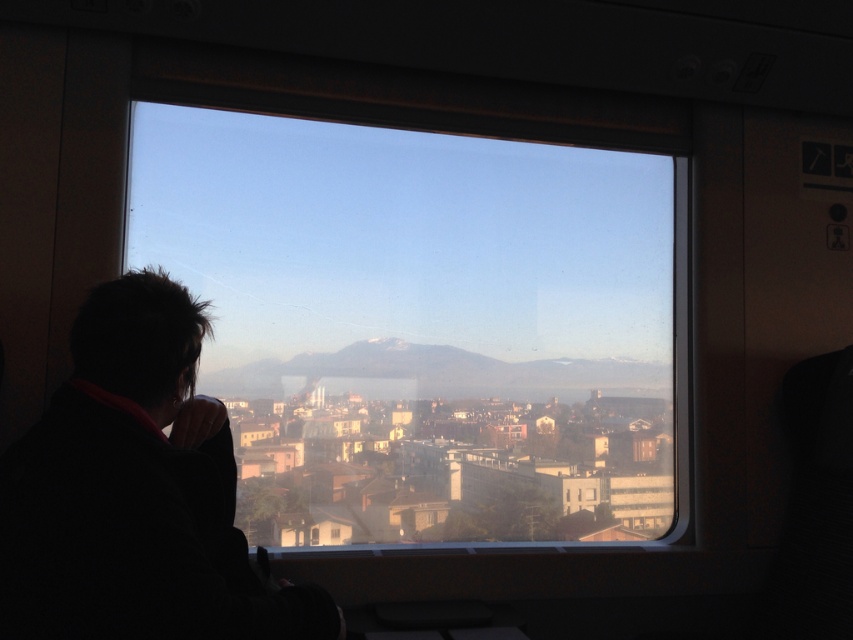
Question: Which point is farther to the camera?

Choices:
 (A) black fabric at left
 (B) transparent glass window at center

Answer: (B)

Question: Is transparent glass window at center above black fabric at left?

Choices:
 (A) no
 (B) yes

Answer: (B)

Question: Which point appears closest to the camera in this image?

Choices:
 (A) (190, 310)
 (B) (227, 132)

Answer: (A)

Question: Does transparent glass window at center have a larger size compared to black fabric at left?

Choices:
 (A) no
 (B) yes

Answer: (B)

Question: Which point appears closest to the camera in this image?

Choices:
 (A) [115, 593]
 (B) [607, 212]

Answer: (A)

Question: Observing the image, what is the correct spatial positioning of transparent glass window at center in reference to black fabric at left?

Choices:
 (A) left
 (B) right

Answer: (B)